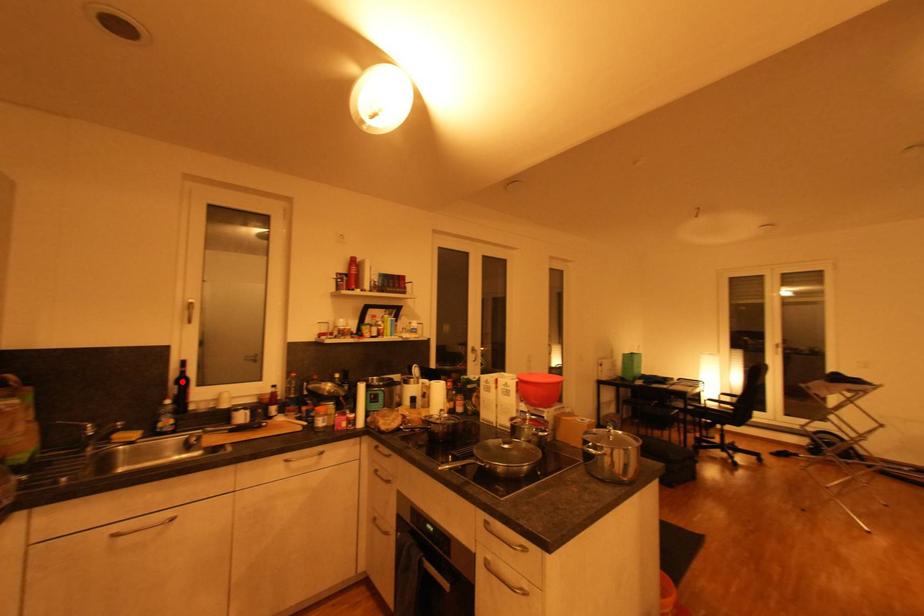
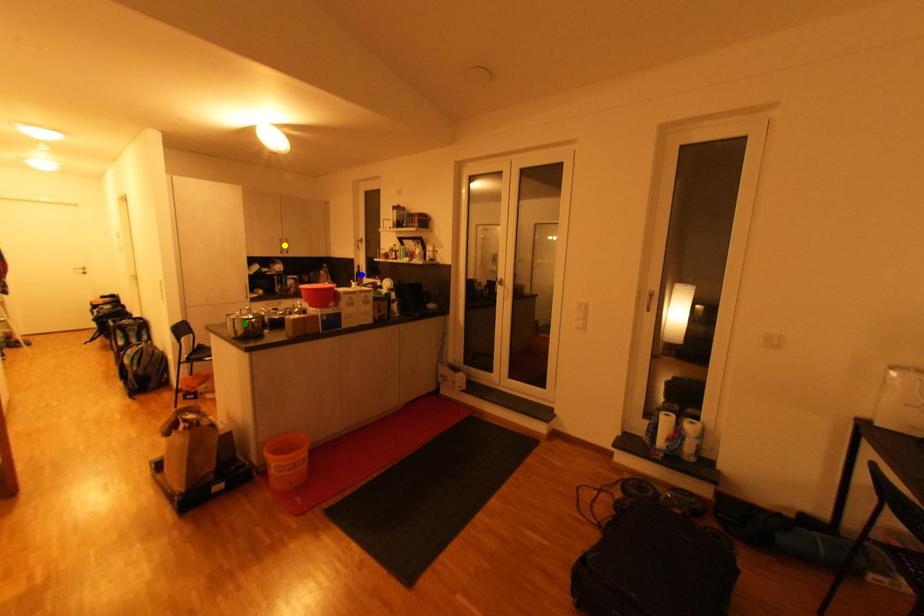
Question: I am providing you with two images of the same scene from different viewpoints. A red point is marked on the first image. You are given multiple points on the second image. Which mark in image 2 goes with the point in image 1?

Choices:
 (A) blue point
 (B) yellow point
 (C) green point

Answer: (A)